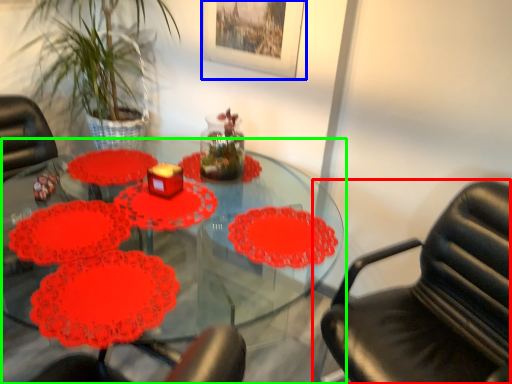
Question: Based on their relative distances, which object is farther from chair (highlighted by a red box)? Choose from picture frame (highlighted by a blue box) and table (highlighted by a green box).

Choices:
 (A) picture frame
 (B) table

Answer: (A)